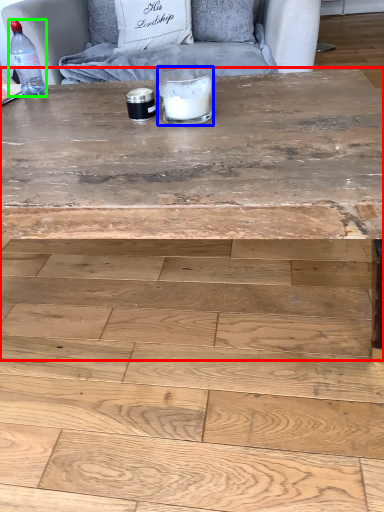
Question: Estimate the real-world distances between objects in this image. Which object is farther from coffee table (highlighted by a red box), candle holder (highlighted by a blue box) or bottle (highlighted by a green box)?

Choices:
 (A) candle holder
 (B) bottle

Answer: (B)